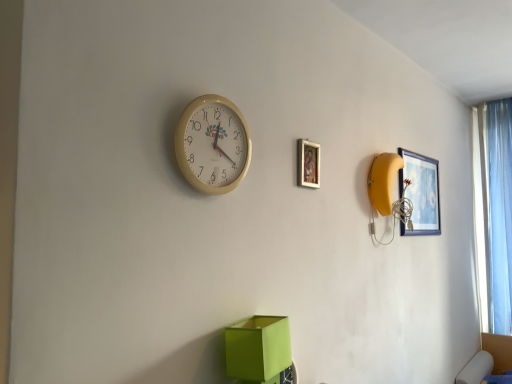
Question: Is beige plastic wall clock at upper center smaller than matte blue picture frame at upper right, placed as the second picture frame when sorted from front to back?

Choices:
 (A) no
 (B) yes

Answer: (B)

Question: Is beige plastic wall clock at upper center facing away from matte blue picture frame at upper right, the 2th picture frame from the left?

Choices:
 (A) no
 (B) yes

Answer: (A)

Question: From the image's perspective, is beige plastic wall clock at upper center beneath matte blue picture frame at upper right, which is the 1th picture frame in back-to-front order?

Choices:
 (A) yes
 (B) no

Answer: (B)

Question: Is beige plastic wall clock at upper center shorter than matte blue picture frame at upper right, the 2th picture frame from the left?

Choices:
 (A) no
 (B) yes

Answer: (B)

Question: Is beige plastic wall clock at upper center not near matte blue picture frame at upper right, which is the first picture frame from right to left?

Choices:
 (A) no
 (B) yes

Answer: (B)

Question: Considering the relative sizes of beige plastic wall clock at upper center and matte blue picture frame at upper right, the 2th picture frame from the left, in the image provided, is beige plastic wall clock at upper center taller than matte blue picture frame at upper right, the 2th picture frame from the left,?

Choices:
 (A) yes
 (B) no

Answer: (B)

Question: Is light blue sheer curtain at right facing away from beige plastic wall clock at upper center?

Choices:
 (A) yes
 (B) no

Answer: (B)

Question: Does light blue sheer curtain at right contain beige plastic wall clock at upper center?

Choices:
 (A) yes
 (B) no

Answer: (B)

Question: Are light blue sheer curtain at right and beige plastic wall clock at upper center located far from each other?

Choices:
 (A) no
 (B) yes

Answer: (B)

Question: From a real-world perspective, is light blue sheer curtain at right located higher than beige plastic wall clock at upper center?

Choices:
 (A) yes
 (B) no

Answer: (B)

Question: Can you confirm if light blue sheer curtain at right is smaller than beige plastic wall clock at upper center?

Choices:
 (A) no
 (B) yes

Answer: (A)

Question: Does light blue sheer curtain at right appear on the left side of beige plastic wall clock at upper center?

Choices:
 (A) no
 (B) yes

Answer: (A)

Question: Is wooden picture frame at upper center, positioned as the second picture frame in back-to-front order, wider than light blue sheer curtain at right?

Choices:
 (A) no
 (B) yes

Answer: (A)